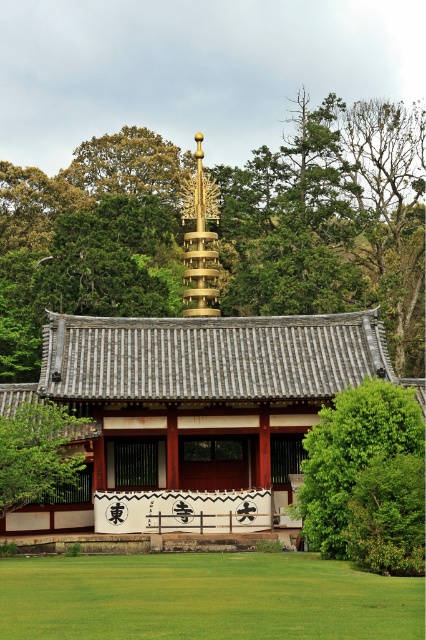
Question: Which point appears closest to the camera in this image?

Choices:
 (A) (319, 426)
 (B) (17, 442)
 (C) (270, 180)
 (D) (305, 611)

Answer: (D)

Question: Can you confirm if green leafy tree at center is positioned to the left of green leafy tree at right?

Choices:
 (A) yes
 (B) no

Answer: (A)

Question: Does green leafy tree at right appear under green leafy tree at lower left?

Choices:
 (A) no
 (B) yes

Answer: (B)

Question: Among these objects, which one is nearest to the camera?

Choices:
 (A) green leafy tree at lower left
 (B) green grass at lower center
 (C) green leafy tree at center

Answer: (B)

Question: Is green leafy tree at right bigger than green leafy tree at lower left?

Choices:
 (A) yes
 (B) no

Answer: (A)

Question: Estimate the real-world distances between objects in this image. Which object is closer to the green leafy tree at right?

Choices:
 (A) green grass at lower center
 (B) green leafy tree at lower left

Answer: (A)